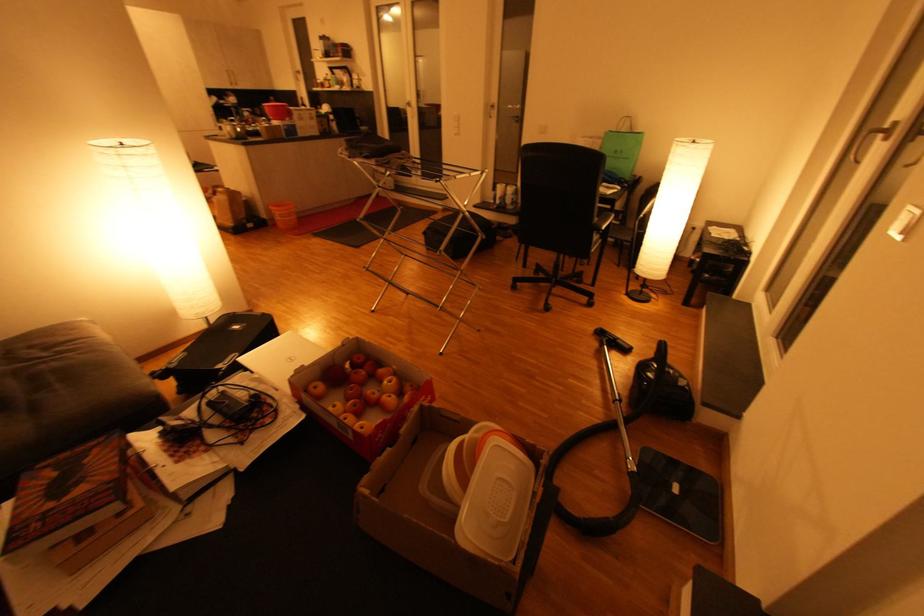
This screenshot has width=924, height=616. Describe the element at coordinates (870, 139) in the screenshot. I see `the door handle` at that location.